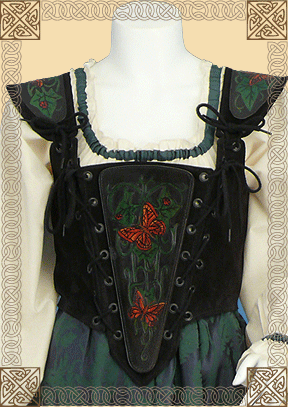
Find the location of a particular element. corner designs is located at coordinates (21, 389), (268, 386), (265, 17), (19, 17).